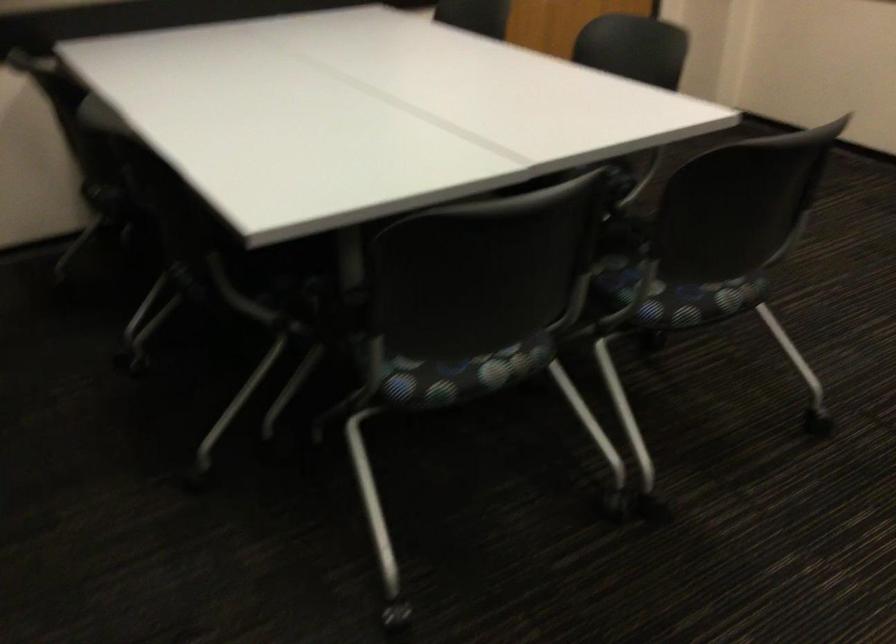
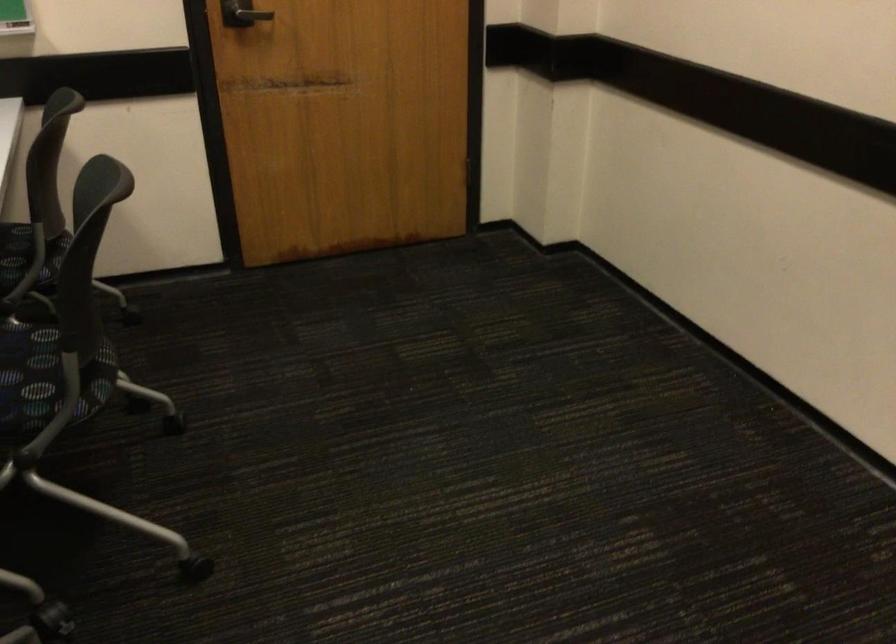
Which direction would the cameraman need to move to produce the second image?

The movement direction of the cameraman is right, forward.